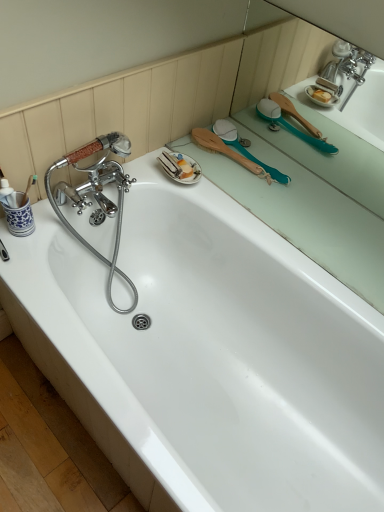
You are a GUI agent. You are given a task and a screenshot of the screen. Output one action in this format:
    pyautogui.click(x=<x>, y=<y>)
    Task: Click on the space that is in front of wooden-brushed teal brush at upper right
    This screenshot has width=384, height=512.
    Given the screenshot: What is the action you would take?
    pyautogui.click(x=260, y=196)